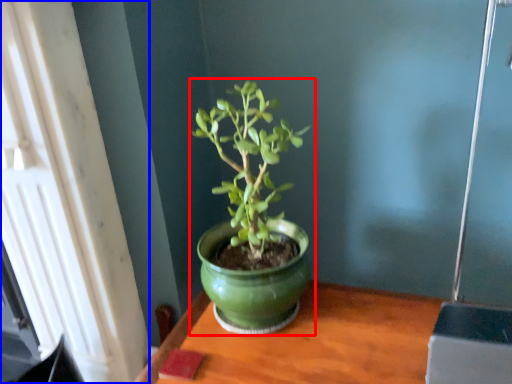
Question: Among these objects, which one is farthest to the camera, houseplant (highlighted by a red box) or window (highlighted by a blue box)?

Choices:
 (A) houseplant
 (B) window

Answer: (A)